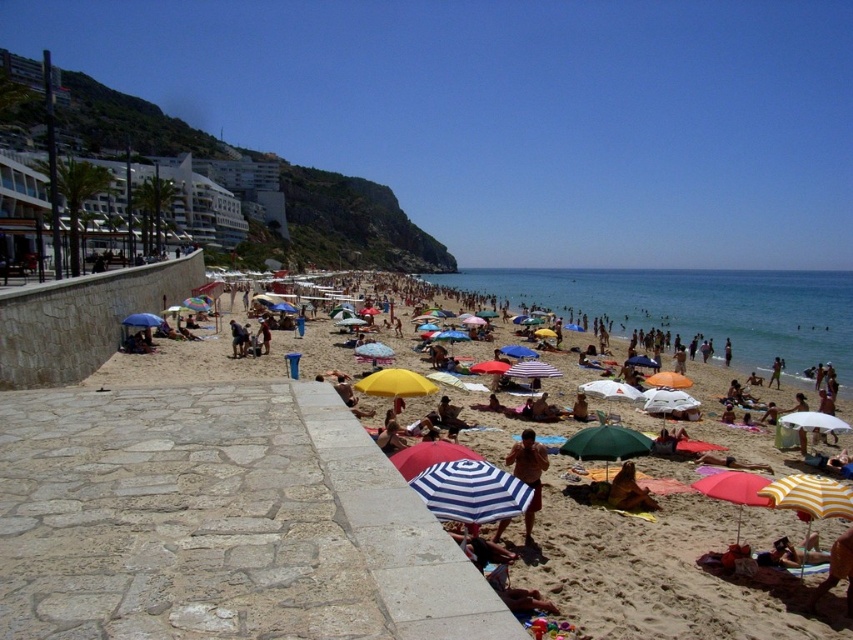
You are a photographer standing on the stone walkway at the beach. You want to take a photo of the dark brown leather jacket at center without the green fabric umbrella at center blocking it. What should you do?

The green fabric umbrella at center is in front of the dark brown leather jacket at center, so you should move behind the umbrella to take the photo so that the jacket is visible without obstruction.